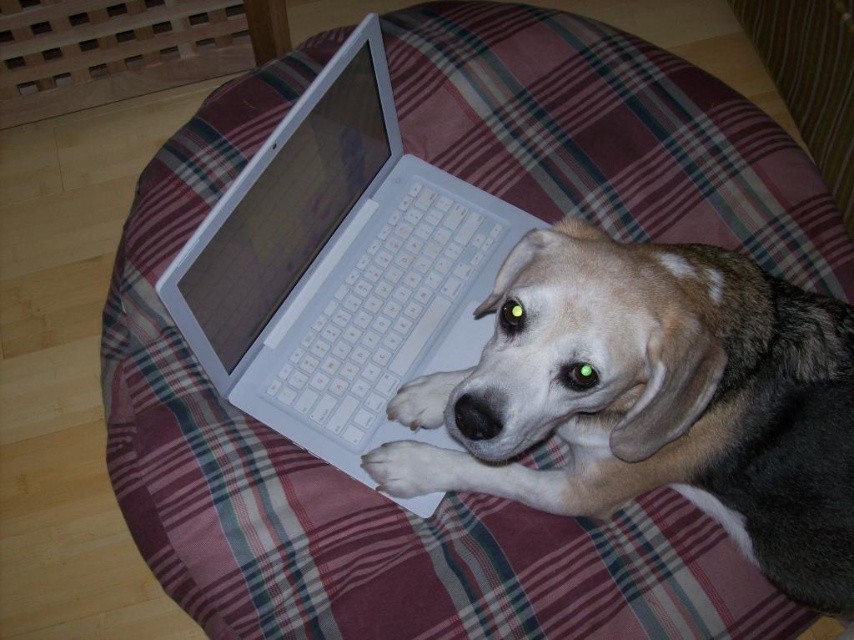
You are a photographer trying to capture the dog on the plaid cushion. The dog is lying on a white plastic laptop at center. To ensure the laptop remains in the frame, where should you position your camera relative to the dog?

The white plastic laptop at center is located at point 2D coordinates (338, 268). To keep the laptop in the frame, position the camera so that the center of the image aligns with these coordinates.

You are a pet owner who wants to move the white plastic keyboard at center away from the dog. Which direction should you move it to ensure it is no longer near the white soft paw at lower center?

The white plastic keyboard at center is currently on the left side of the white soft paw at lower center. To move it away from the paw, you should move it to the right side of the white soft paw at lower center.